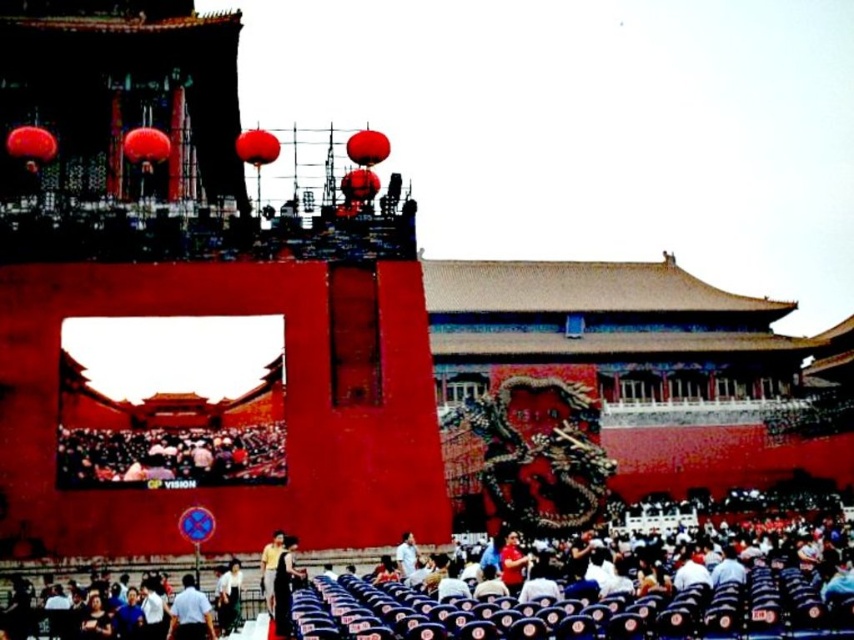
Question: Does dark blue fabric seats at lower center appear on the right side of yellow shirt at lower center?

Choices:
 (A) no
 (B) yes

Answer: (B)

Question: Estimate the real-world distances between objects in this image. Which object is closer to the yellow shirt at lower center?

Choices:
 (A) dark blue shirt at lower center
 (B) dark blue fabric seats at lower center

Answer: (A)

Question: Where is dark gray fabric crowd at lower left located in relation to dark blue shirt at lower center in the image?

Choices:
 (A) left
 (B) right

Answer: (A)

Question: Among these objects, which one is farthest from the camera?

Choices:
 (A) black fabric person at lower center
 (B) dark blue shirt at lower center

Answer: (B)

Question: Among these objects, which one is nearest to the camera?

Choices:
 (A) dark gray fabric crowd at lower left
 (B) dark blue fabric seats at lower center
 (C) black fabric person at lower center
 (D) yellow shirt at lower center

Answer: (B)

Question: Can you confirm if dark blue fabric seats at lower center is positioned below dark gray fabric crowd at lower left?

Choices:
 (A) yes
 (B) no

Answer: (A)